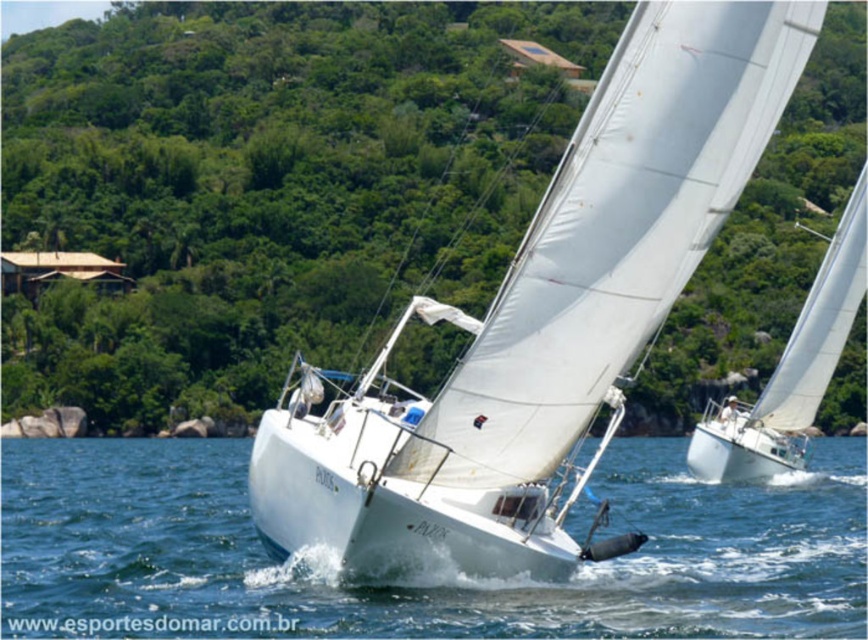
Is clear blue water at center taller than white matte sailboat at right?

In fact, clear blue water at center may be shorter than white matte sailboat at right.

Between point (481, 609) and point (849, 273), which one is positioned behind?

The point (849, 273) is more distant.

You are a GUI agent. You are given a task and a screenshot of the screen. Output one action in this format:
    pyautogui.click(x=<x>, y=<y>)
    Task: Click on the clear blue water at center
    The height and width of the screenshot is (640, 868).
    Given the screenshot: What is the action you would take?
    pyautogui.click(x=423, y=588)

Between point (279, 429) and point (781, 424), which one is positioned in front?

Point (279, 429)

The height and width of the screenshot is (640, 868). I want to click on white matte sailboat at center, so click(544, 317).

Between white matte sailboat at center and clear blue water at center, which one has more height?

Standing taller between the two is white matte sailboat at center.

Can you confirm if white matte sailboat at center is bigger than clear blue water at center?

Actually, white matte sailboat at center might be smaller than clear blue water at center.

Is point (632, 76) positioned behind point (104, 592)?

No, (632, 76) is closer to viewer.

This screenshot has width=868, height=640. What are the coordinates of `white matte sailboat at center` in the screenshot? It's located at (544, 317).